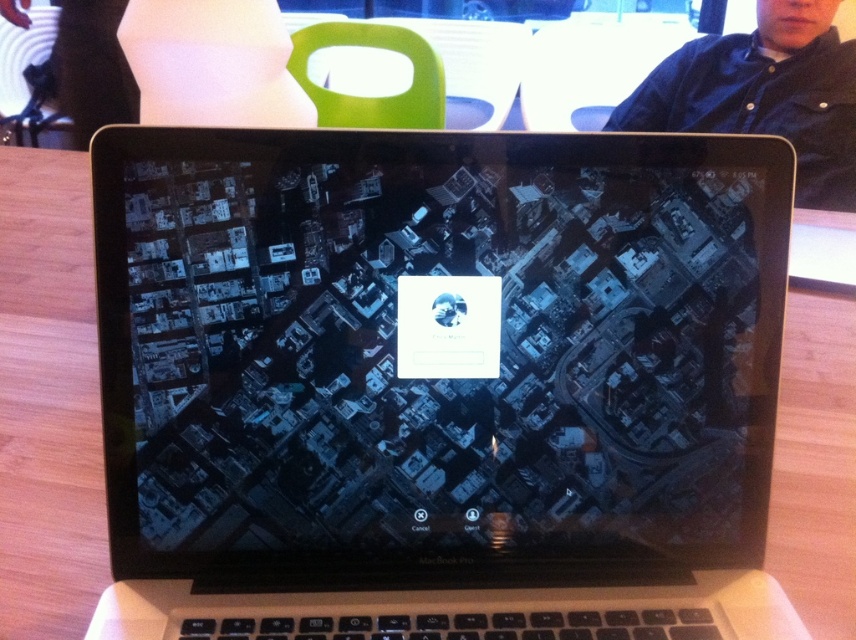
Who is positioned more to the right, sleek silver laptop at center or dark blue shirt at upper right?

From the viewer's perspective, dark blue shirt at upper right appears more on the right side.

You are a GUI agent. You are given a task and a screenshot of the screen. Output one action in this format:
    pyautogui.click(x=<x>, y=<y>)
    Task: Click on the sleek silver laptop at center
    This screenshot has height=640, width=856.
    Given the screenshot: What is the action you would take?
    pyautogui.click(x=438, y=384)

Which is behind, point (226, 276) or point (777, 81)?

Positioned behind is point (777, 81).

Image resolution: width=856 pixels, height=640 pixels. I want to click on sleek silver laptop at center, so click(x=438, y=384).